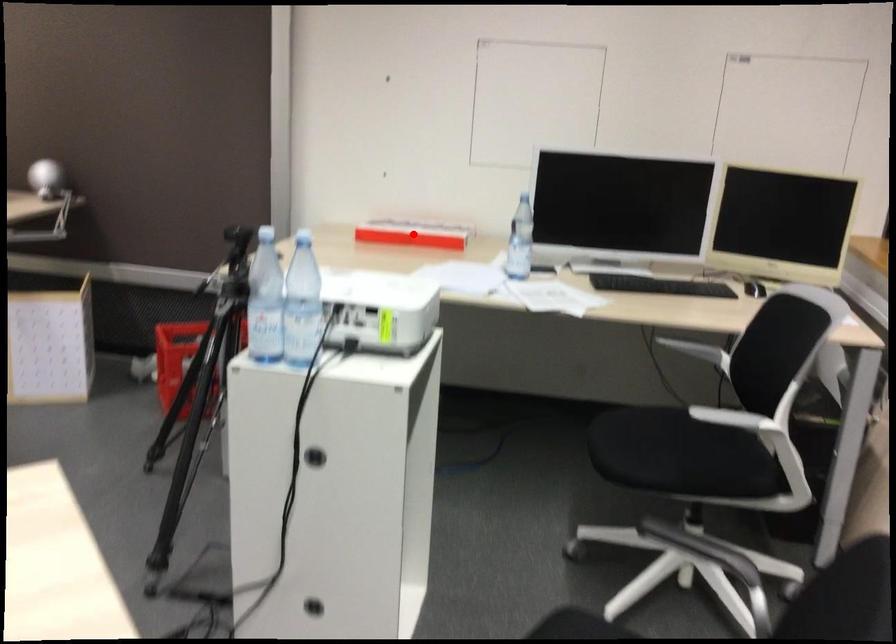
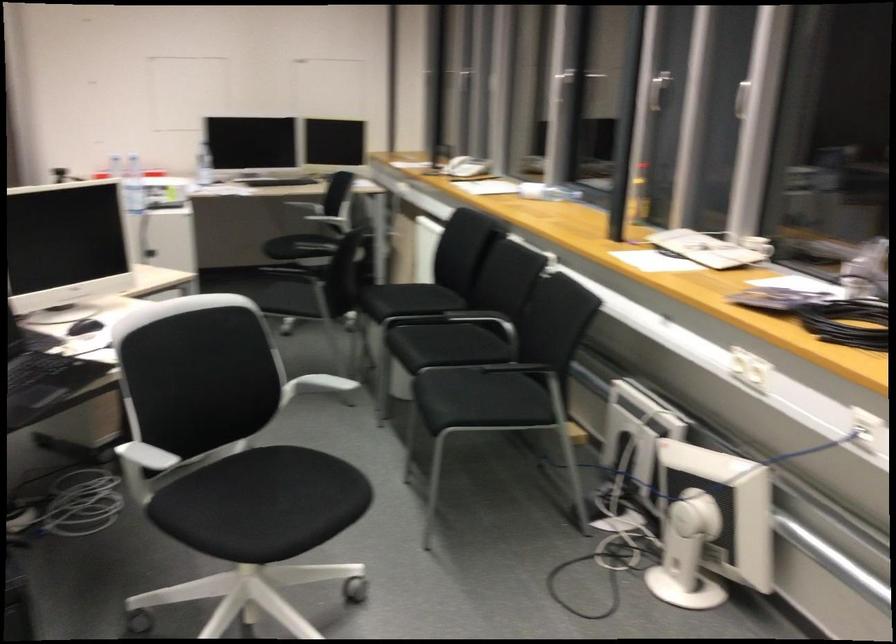
Question: I am providing you with two images of the same scene from different viewpoints. A red point is marked on the first image. Is the red point's position out of view in image 2?

Choices:
 (A) Yes
 (B) No

Answer: (A)